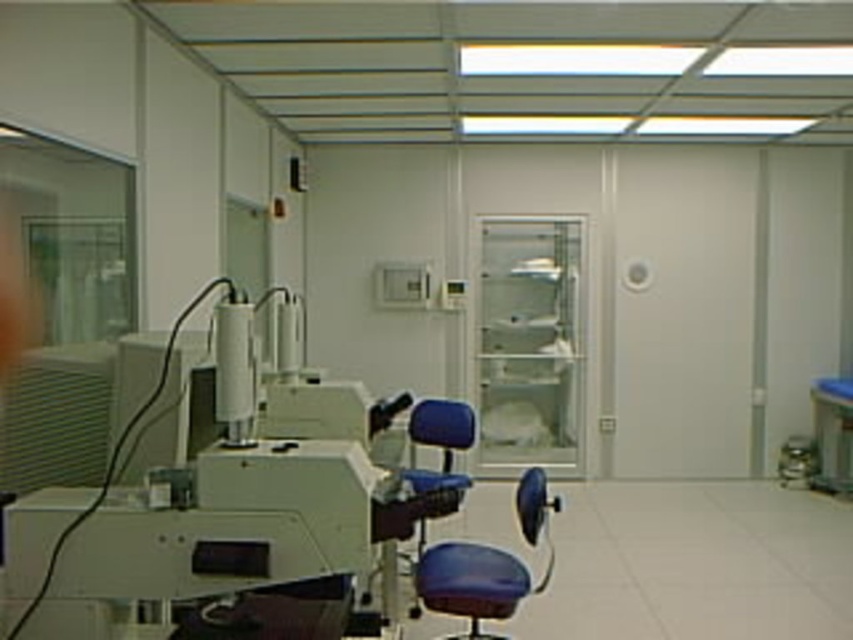
Question: Can you confirm if blue leather swivel chair at center is positioned to the left of matte blue chair at center?

Choices:
 (A) no
 (B) yes

Answer: (A)

Question: Which of the following is the farthest from the observer?

Choices:
 (A) (469, 424)
 (B) (527, 580)

Answer: (A)

Question: Can you confirm if blue leather swivel chair at center is positioned above matte blue chair at center?

Choices:
 (A) no
 (B) yes

Answer: (A)

Question: Among these objects, which one is nearest to the camera?

Choices:
 (A) matte blue chair at center
 (B) blue leather swivel chair at center

Answer: (B)

Question: Among these points, which one is farthest from the camera?

Choices:
 (A) (431, 477)
 (B) (526, 572)

Answer: (A)

Question: Does blue leather swivel chair at center lie in front of matte blue chair at center?

Choices:
 (A) yes
 (B) no

Answer: (A)